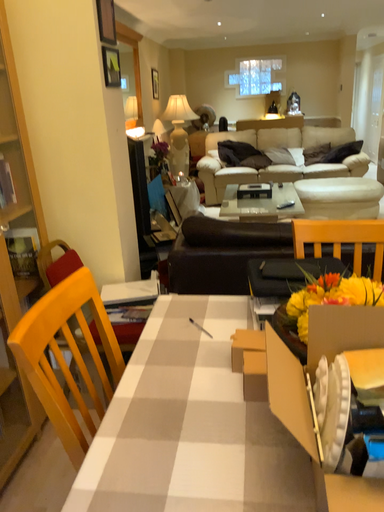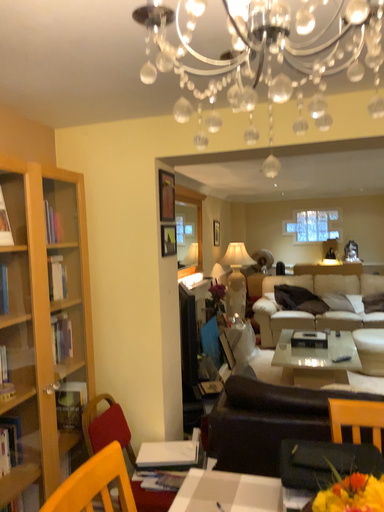
Question: How did the camera likely rotate when shooting the video?

Choices:
 (A) rotated downward
 (B) rotated upward

Answer: (B)